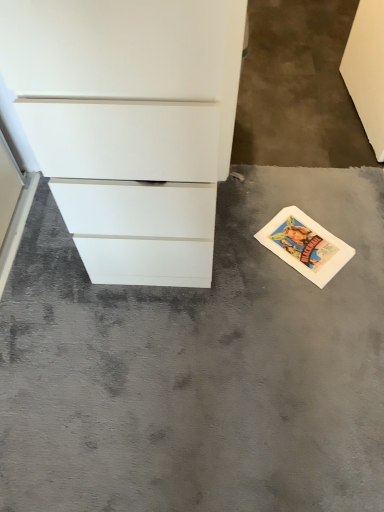
You are a GUI agent. You are given a task and a screenshot of the screen. Output one action in this format:
    pyautogui.click(x=<x>, y=<y>)
    Task: Click on the free point in front of white matte chest of drawers at left
    
    Given the screenshot: What is the action you would take?
    pyautogui.click(x=182, y=336)